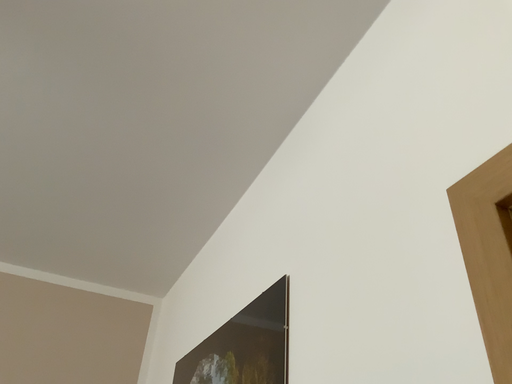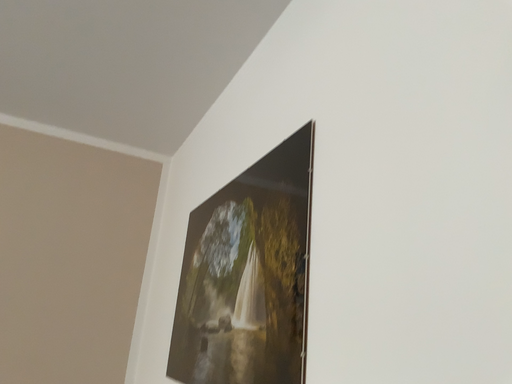
Question: How did the camera likely rotate when shooting the video?

Choices:
 (A) rotated upward
 (B) rotated downward

Answer: (B)